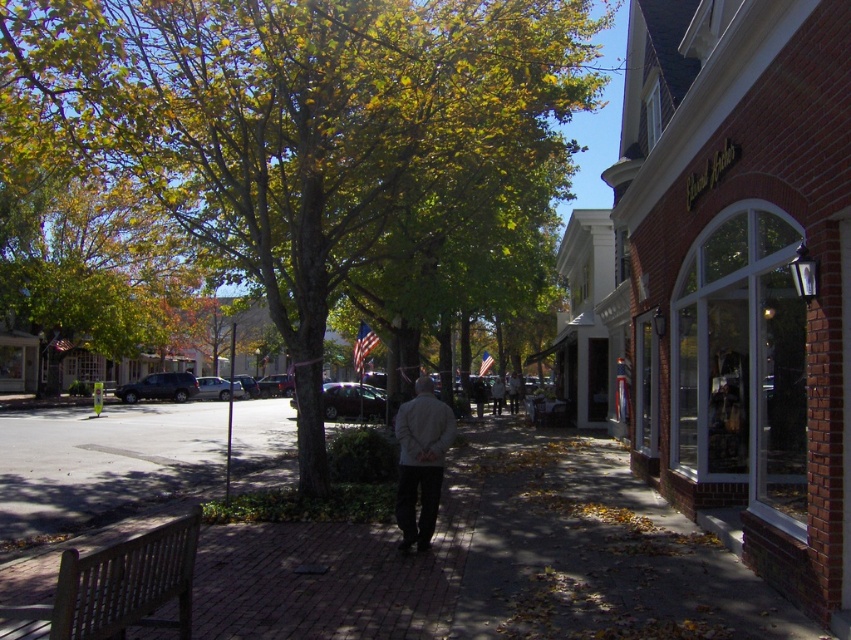
Who is taller, brick pavement at center or wooden bench at lower left?

brick pavement at center is taller.

Is brick pavement at center bigger than wooden bench at lower left?

Indeed, brick pavement at center has a larger size compared to wooden bench at lower left.

Is point (568, 524) in front of point (44, 611)?

No, it is behind (44, 611).

Locate an element on the screen. This screenshot has width=851, height=640. brick pavement at center is located at coordinates (495, 561).

Between point (483, 460) and point (435, 417), which one is positioned behind?

Positioned behind is point (483, 460).

Find the location of a particular element. This screenshot has width=851, height=640. brick pavement at center is located at coordinates (495, 561).

Is point (260, 627) positioned behind point (427, 538)?

No.

Find the location of a particular element. The width and height of the screenshot is (851, 640). brick pavement at center is located at coordinates (495, 561).

Is green leafy tree at center in front of light gray jacket at center?

Yes.

Is green leafy tree at center to the right of light gray jacket at center from the viewer's perspective?

In fact, green leafy tree at center is to the left of light gray jacket at center.

Does point (206, 230) come behind point (409, 500)?

Yes, it is behind point (409, 500).

This screenshot has width=851, height=640. In order to click on green leafy tree at center in this screenshot , I will do `click(297, 157)`.